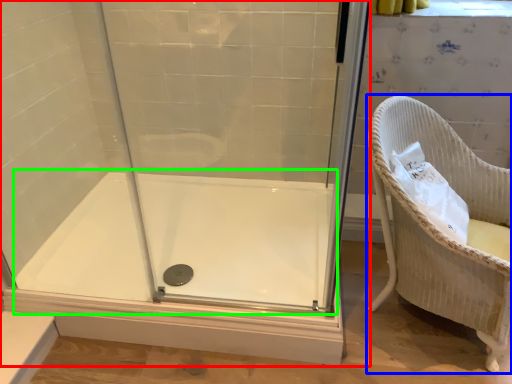
Question: Which is nearer to the shower door (highlighted by a red box)? furniture (highlighted by a blue box) or bath (highlighted by a green box).

Choices:
 (A) furniture
 (B) bath

Answer: (B)